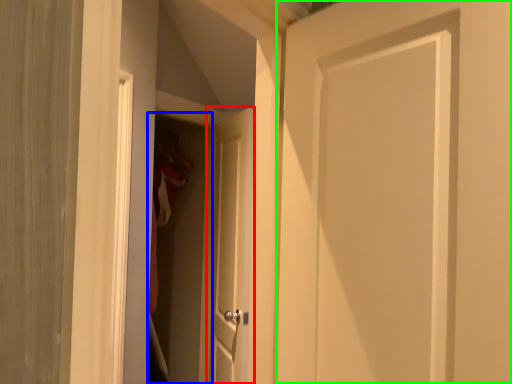
Question: Based on their relative distances, which object is farther from door (highlighted by a red box)? Choose from screen door (highlighted by a blue box) and door (highlighted by a green box).

Choices:
 (A) screen door
 (B) door

Answer: (B)